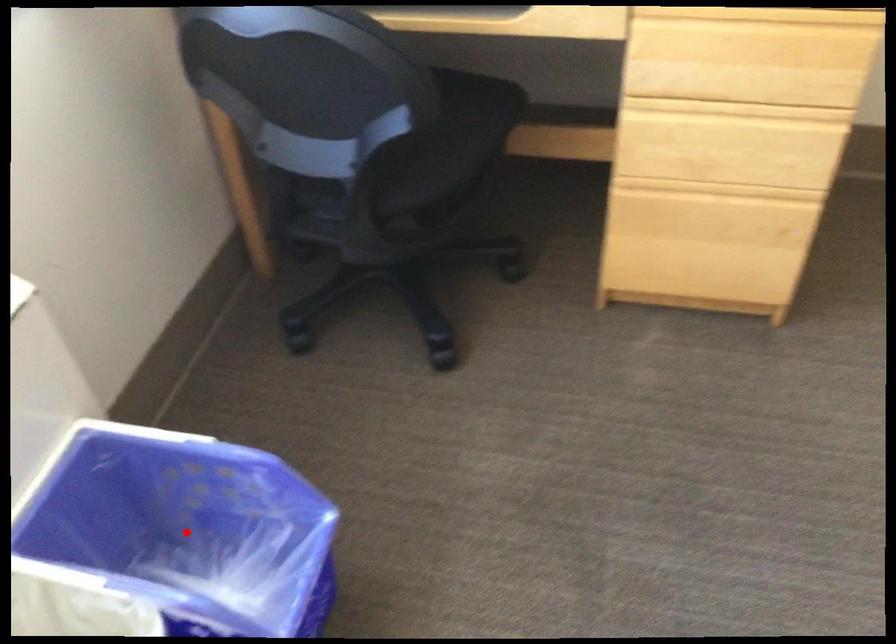
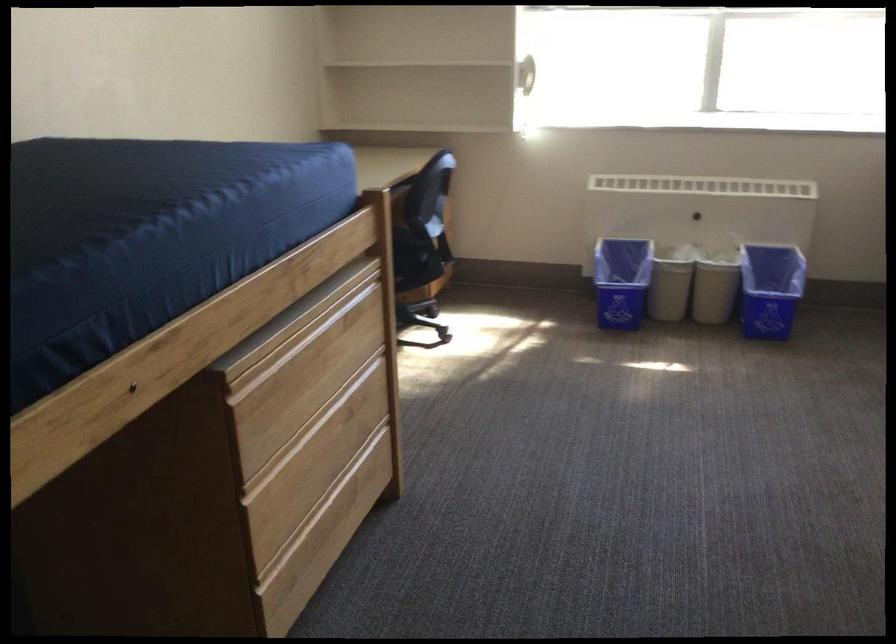
Question: I am providing you with two images of the same scene from different viewpoints. A red point is marked on the first image. At the location where the point appears in image 1, is it still visible in image 2?

Choices:
 (A) Yes
 (B) No

Answer: (A)